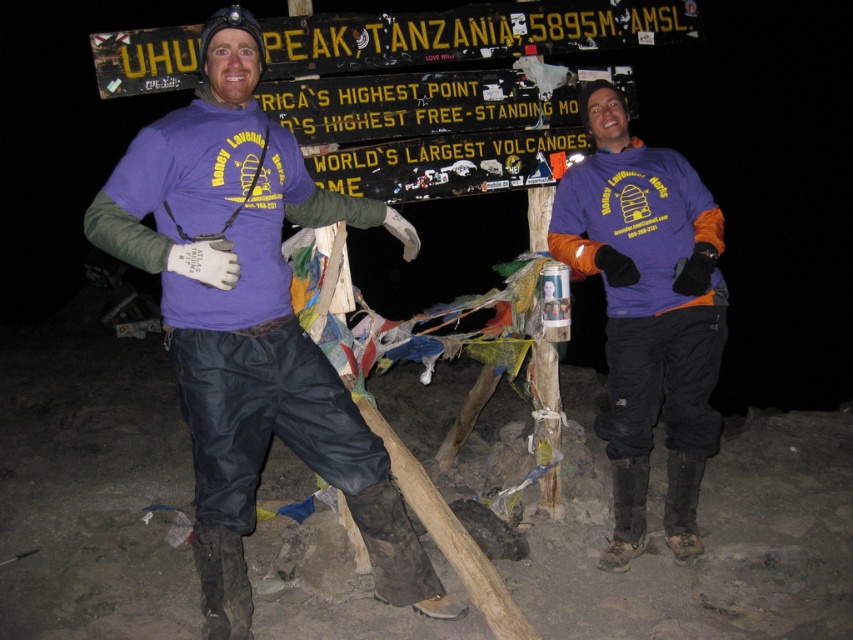
You are standing at UHURU PEAK, TANZANIA, and wearing a purple fabric shirt at center. A fellow hiker approaches you and asks if they can safely pass between you and the signboard without getting too close. The hiker is 1.8 meters tall. Can they pass comfortably through the space between you and the signboard?

The distance between the purple fabric shirt at center and the viewer is 2.13 meters. Since the hiker is 1.8 meters tall, they can comfortably pass through the space as the distance is greater than their height.

You are a photographer trying to capture both the purple fabric shirt at center and the purple fabric shirt at right in a single frame. Based on their positions, which shirt should you focus on first to ensure both are in the shot?

Since the purple fabric shirt at center is wider than the purple fabric shirt at right, you should focus on the purple fabric shirt at center first to ensure both are in the shot.